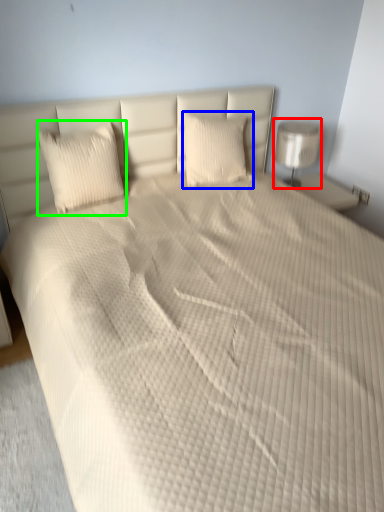
Question: Estimate the real-world distances between objects in this image. Which object is closer to lamp (highlighted by a red box), pillow (highlighted by a blue box) or pillow (highlighted by a green box)?

Choices:
 (A) pillow
 (B) pillow

Answer: (A)